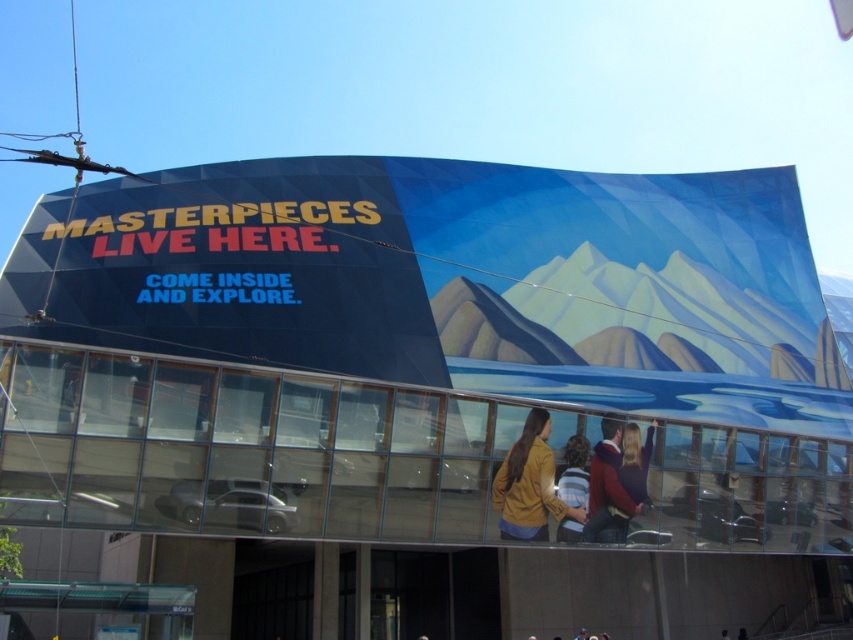
You are a delivery person standing at the entrance of the building. You need to place a matte yellow jacket at center and a striped sweater at center on a display table. The display table is 5 meters long. Can both items fit on the table without overlapping?

The matte yellow jacket at center and striped sweater at center are 4.91 meters apart, so yes, both items can fit on the 5 meter long display table without overlapping.

You are a fashion designer looking at a building facade advertisement. You see a matte yellow jacket at center and a maroon sweater at center. Which one is more to the left?

The matte yellow jacket at center is positioned on the left side of maroon sweater at center, so it is more to the left.

You are standing in front of the building and see both the maroon sweater at center and the striped sweater at center. Which sweater is positioned more to the right?

The maroon sweater at center is positioned more to the right than the striped sweater at center.